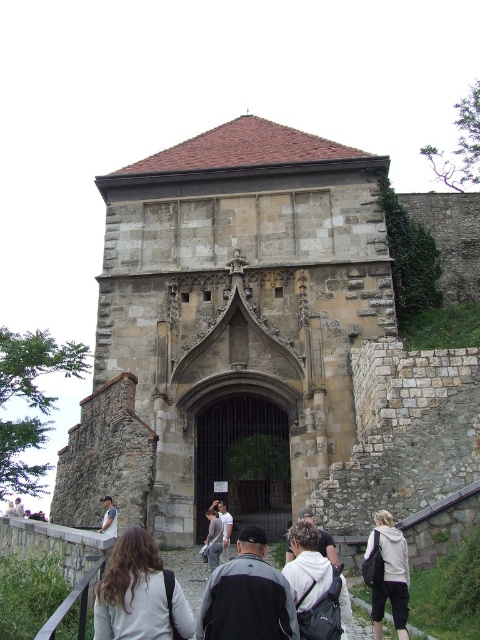
Which is below, light gray hoodie at center or light brown leather jacket at lower left?

light brown leather jacket at lower left is below.

What do you see at coordinates (389, 576) in the screenshot? Image resolution: width=480 pixels, height=640 pixels. I see `light gray hoodie at center` at bounding box center [389, 576].

Measure the distance between point (394, 545) and camera.

A distance of 33.72 meters exists between point (394, 545) and camera.

At what (x,y) coordinates should I click in order to perform the action: click on light gray hoodie at center. Please return your answer as a coordinate pair (x, y). The width and height of the screenshot is (480, 640). Looking at the image, I should click on (389, 576).

Does stone gothic church at center have a lesser width compared to dark gray fabric jacket at center?

No, stone gothic church at center is not thinner than dark gray fabric jacket at center.

Is stone gothic church at center bigger than dark gray fabric jacket at center?

Yes.

Locate an element on the screen. The width and height of the screenshot is (480, 640). stone gothic church at center is located at coordinates (259, 348).

You are a GUI agent. You are given a task and a screenshot of the screen. Output one action in this format:
    pyautogui.click(x=<x>, y=<y>)
    Task: Click on the stone gothic church at center
    
    Given the screenshot: What is the action you would take?
    pyautogui.click(x=259, y=348)

Between point (231, 401) and point (113, 513), which one is positioned behind?

Positioned behind is point (231, 401).

Can you confirm if stone gothic church at center is shorter than light brown leather jacket at lower left?

No.

Does point (171, 317) come farther from viewer compared to point (115, 528)?

Yes, it is.

Image resolution: width=480 pixels, height=640 pixels. Find the location of `stone gothic church at center`. stone gothic church at center is located at coordinates (259, 348).